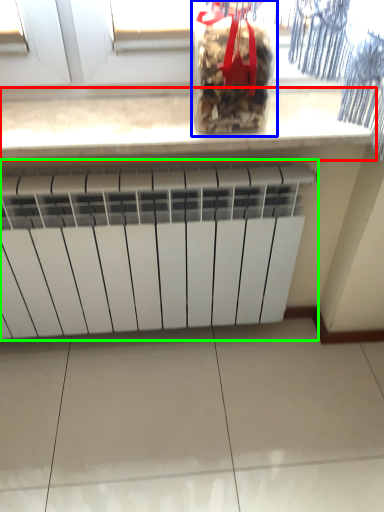
Question: Which is nearer to the countertop (highlighted by a red box)? wine bottle (highlighted by a blue box) or radiator (highlighted by a green box).

Choices:
 (A) wine bottle
 (B) radiator

Answer: (A)